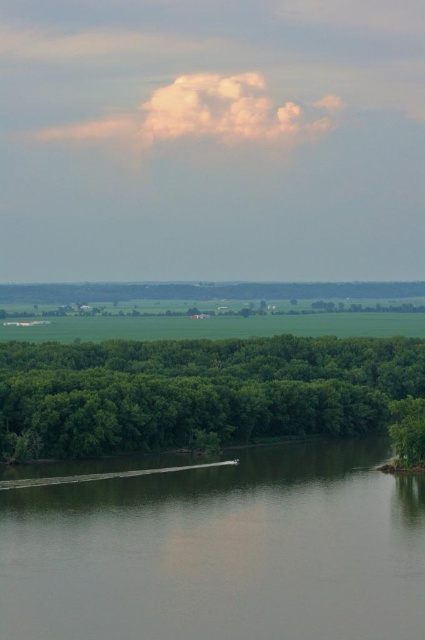
Is gray smooth water at lower center positioned in front of green leafy trees at lower center?

Yes, it is.

Identify the location of gray smooth water at lower center. This screenshot has width=425, height=640. (221, 552).